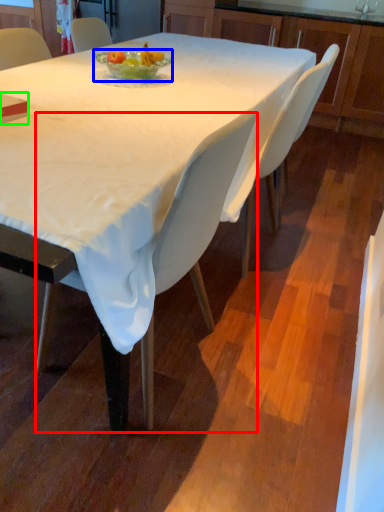
Question: Considering the real-world distances, which object is farthest from chair (highlighted by a red box)? bowl (highlighted by a blue box) or book (highlighted by a green box)?

Choices:
 (A) bowl
 (B) book

Answer: (A)